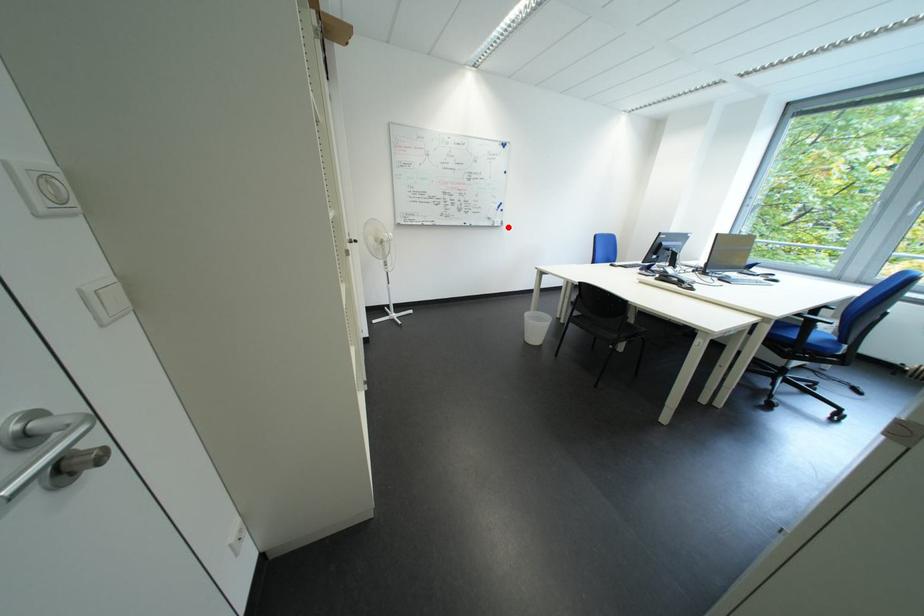
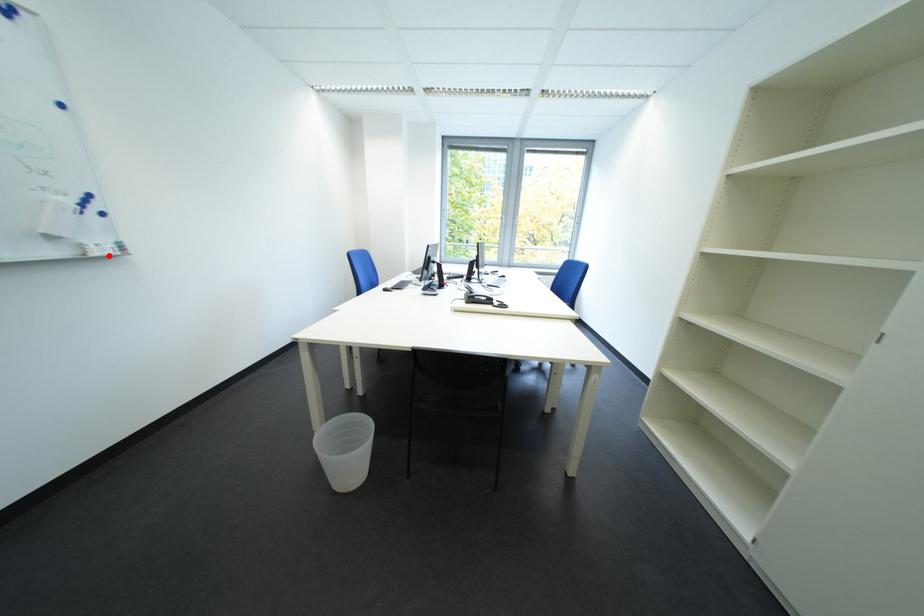
I am providing you with two images of the same scene from different viewpoints. A red point is marked on the first image and another point is marked on the second image. Does the point marked in image1 correspond to the same location as the one in image2?

Yes